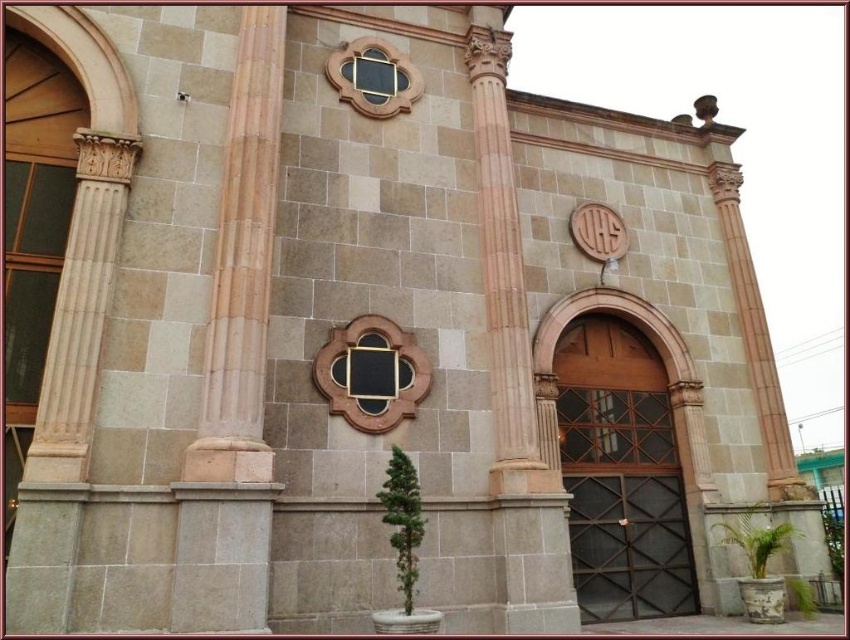
You are an architect reviewing the building facade and notice two windows. The black matte window at center and the matte gold window at upper center. Which window is closer to you?

The black matte window at center is closer to you because it is in front of the matte gold window at upper center.

Based on the photo, you are standing in front of a classical building and want to take a photo of the sandy stone column at left. If your camera can focus on objects up to 25 feet away, will it be able to capture the column clearly?

The sandy stone column at left is 24.34 feet from camera, so yes, the camera can focus on it clearly since it is within the 25 feet range.

You are an architect designing a new building and want to ensure the entrance area maintains a balanced look. Given the presence of the sandy stone column at left and the black matte window at center, which object takes up more visual space in the entrance area?

The black matte window at center takes up more visual space than the sandy stone column at left, as it occupies more space according to the description.